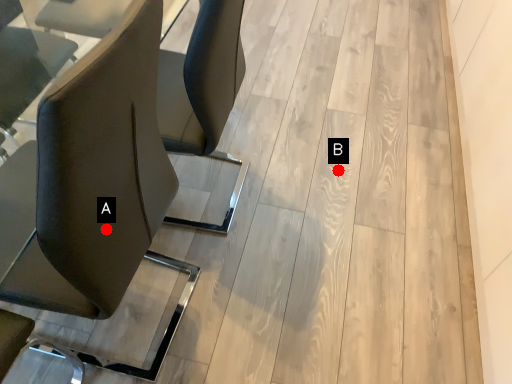
Question: Two points are circled on the image, labeled by A and B beside each circle. Among these points, which one is farthest from the camera?

Choices:
 (A) A is further
 (B) B is further

Answer: (B)